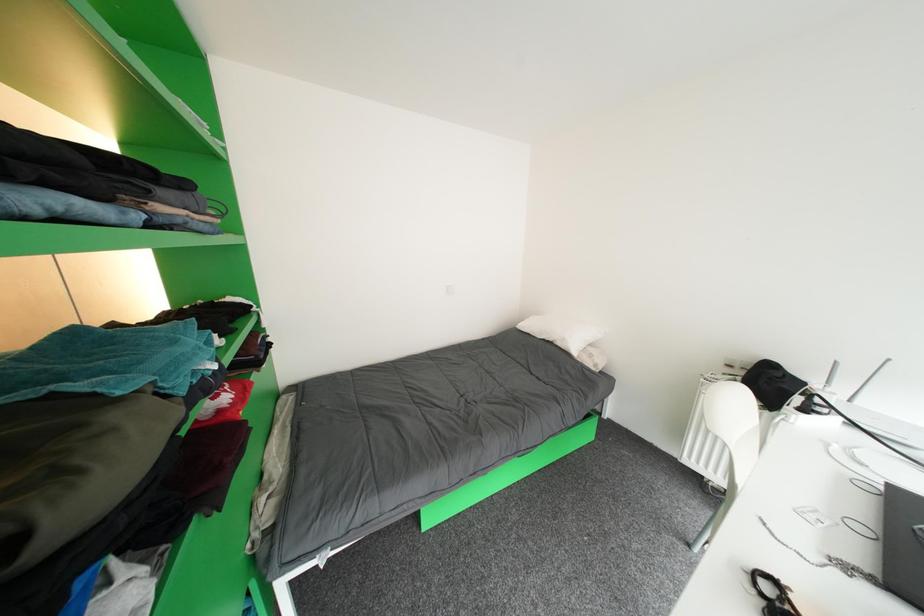
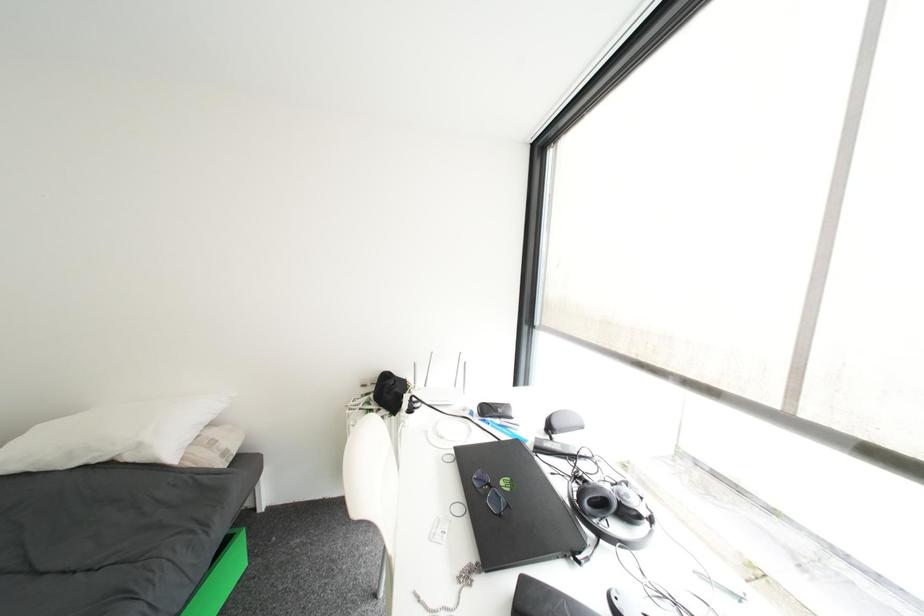
Question: How did the camera likely rotate?

Choices:
 (A) Left
 (B) Right
 (C) Up
 (D) Down

Answer: (B)